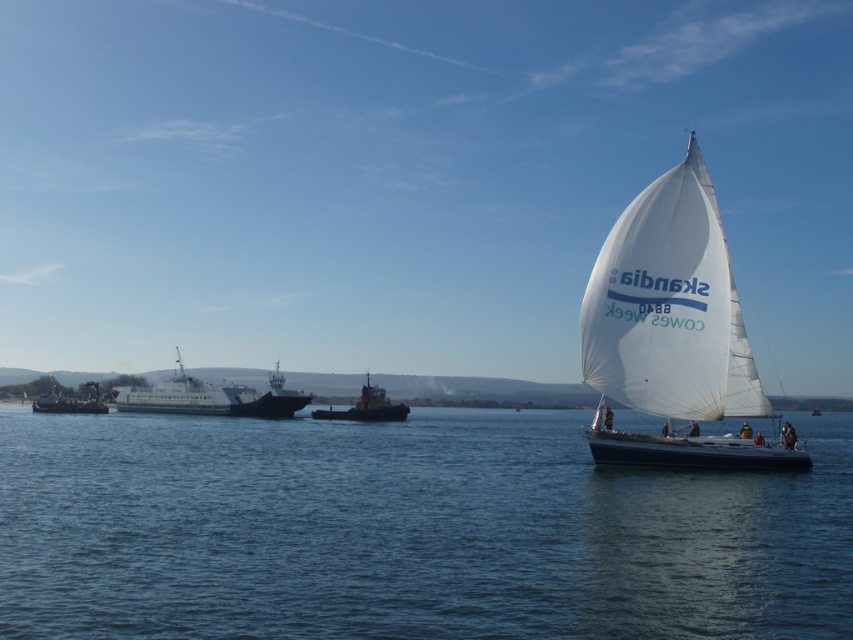
Question: Observing the image, what is the correct spatial positioning of dark gray metallic ferry at left in reference to orange metallic tugboat at center?

Choices:
 (A) left
 (B) right

Answer: (A)

Question: Which point appears farthest from the camera in this image?

Choices:
 (A) (51, 394)
 (B) (351, 410)

Answer: (A)

Question: Where is dark gray metallic ferry at left located in relation to metallic gray ship at left in the image?

Choices:
 (A) above
 (B) below

Answer: (A)

Question: Based on their relative distances, which object is nearer to the blue water at center?

Choices:
 (A) white sailboat at right
 (B) orange metallic tugboat at center
 (C) dark gray metallic ferry at left
 (D) metallic gray ship at left

Answer: (A)

Question: Which of the following is the closest to the observer?

Choices:
 (A) (204, 400)
 (B) (390, 420)
 (C) (161, 515)

Answer: (C)

Question: Can you confirm if blue water at center is positioned below orange metallic tugboat at center?

Choices:
 (A) no
 (B) yes

Answer: (A)